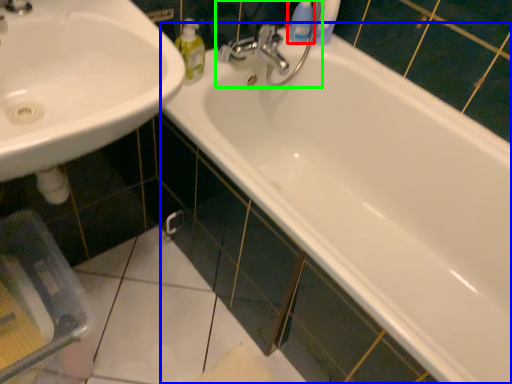
Question: Considering the real-world distances, which object is farthest from cleaning product (highlighted by a red box)? bathtub (highlighted by a blue box) or plumbing fixture (highlighted by a green box)?

Choices:
 (A) bathtub
 (B) plumbing fixture

Answer: (A)